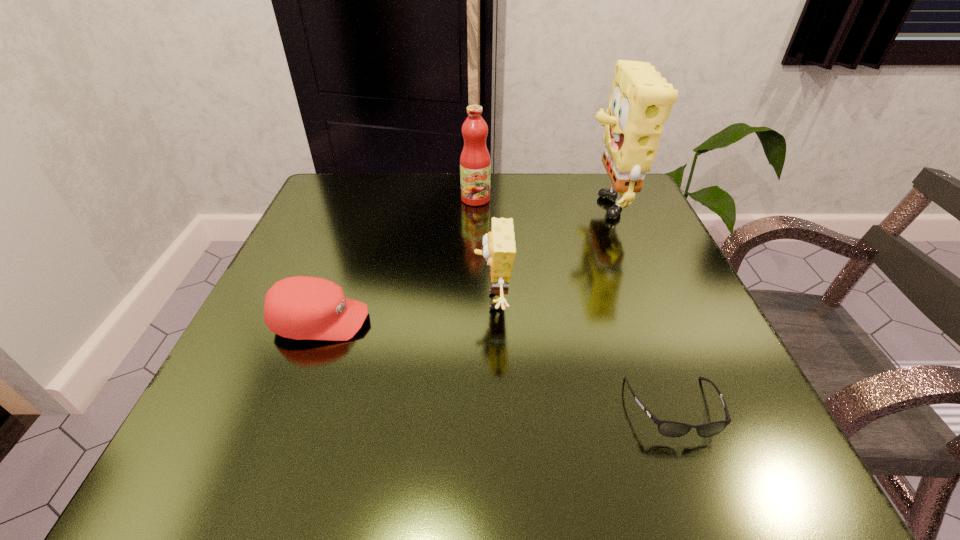
The width and height of the screenshot is (960, 540). I want to click on object that is at the left edge, so click(301, 307).

At what (x,y) coordinates should I click in order to perform the action: click on sponge present at the right edge. Please return your answer as a coordinate pair (x, y). The width and height of the screenshot is (960, 540). Looking at the image, I should click on (641, 101).

Image resolution: width=960 pixels, height=540 pixels. What are the coordinates of `sunglasses at the right edge` in the screenshot? It's located at (666, 428).

Locate an element on the screen. This screenshot has height=540, width=960. object that is at the far right corner is located at coordinates (641, 101).

Locate an element on the screen. The image size is (960, 540). object located at the near right corner is located at coordinates (666, 428).

The width and height of the screenshot is (960, 540). In order to click on free space at the far edge in this screenshot , I will do `click(445, 182)`.

Image resolution: width=960 pixels, height=540 pixels. I want to click on vacant area at the near edge of the desktop, so click(x=521, y=440).

I want to click on vacant space at the left edge of the desktop, so click(252, 373).

I want to click on vacant space at the right edge of the desktop, so click(x=597, y=246).

The image size is (960, 540). Find the location of `free location at the far right corner`. free location at the far right corner is located at coordinates (590, 176).